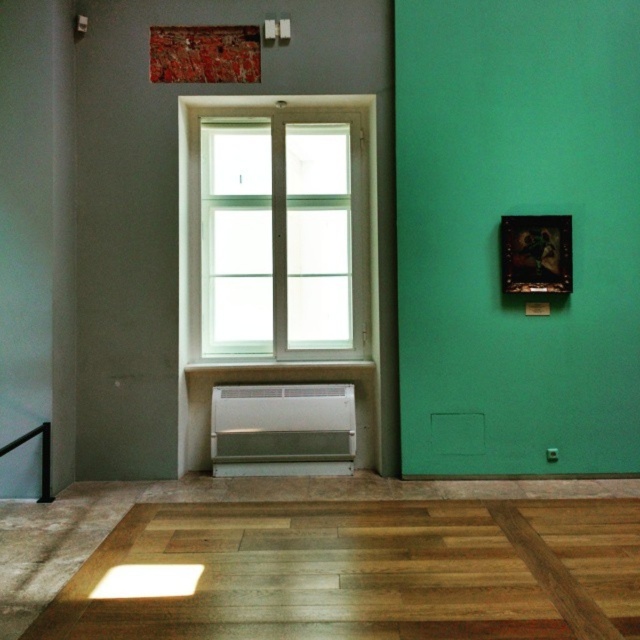
You are an interior designer planning to hang a new painting. The current white plastic radiator at center is located at coordinates 0.672 on the x axis and 0.442 on the y axis. If you want to place the new painting above the radiator, where should you position it in terms of x and y coordinates?

To place the new painting above the white plastic radiator at center, you should position it at a higher y coordinate than 0.442 while keeping the same x coordinate of 0.672. For example, positioning it at approximately x 0.672 and y 0.55 would place it above the radiator.